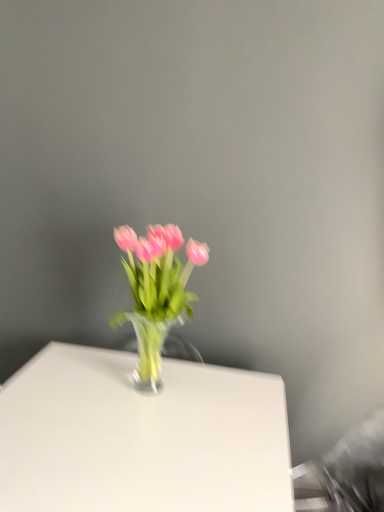
Where is `vacant space that is to the left of pink glass vase at center`? Image resolution: width=384 pixels, height=512 pixels. vacant space that is to the left of pink glass vase at center is located at coordinates (66, 379).